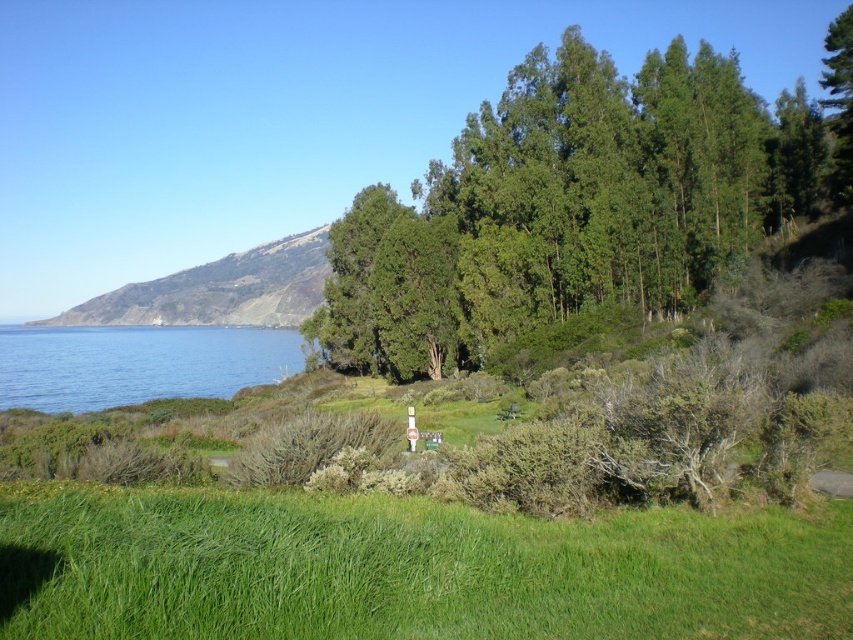
Question: Is green leafy trees at center wider than green grassy hillside at left?

Choices:
 (A) yes
 (B) no

Answer: (B)

Question: Among these objects, which one is nearest to the camera?

Choices:
 (A) blue water at lower left
 (B) green grassy field at lower center
 (C) green leafy trees at center
 (D) green grassy hillside at left

Answer: (B)

Question: Is green leafy trees at center positioned in front of blue water at lower left?

Choices:
 (A) no
 (B) yes

Answer: (B)

Question: Which point is closer to the camera taking this photo?

Choices:
 (A) (689, 515)
 (B) (706, 204)
 (C) (144, 292)

Answer: (A)

Question: Based on their relative distances, which object is nearer to the green grassy field at lower center?

Choices:
 (A) green grassy hillside at left
 (B) blue water at lower left
 (C) green leafy trees at center

Answer: (C)

Question: Is green grassy field at lower center to the left of green grassy hillside at left from the viewer's perspective?

Choices:
 (A) yes
 (B) no

Answer: (B)